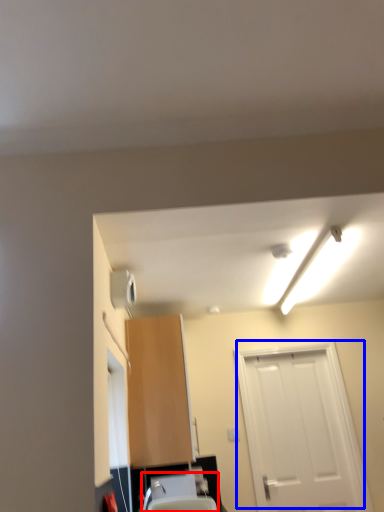
Question: Among these objects, which one is nearest to the camera, sink (highlighted by a red box) or door (highlighted by a blue box)?

Choices:
 (A) sink
 (B) door

Answer: (A)